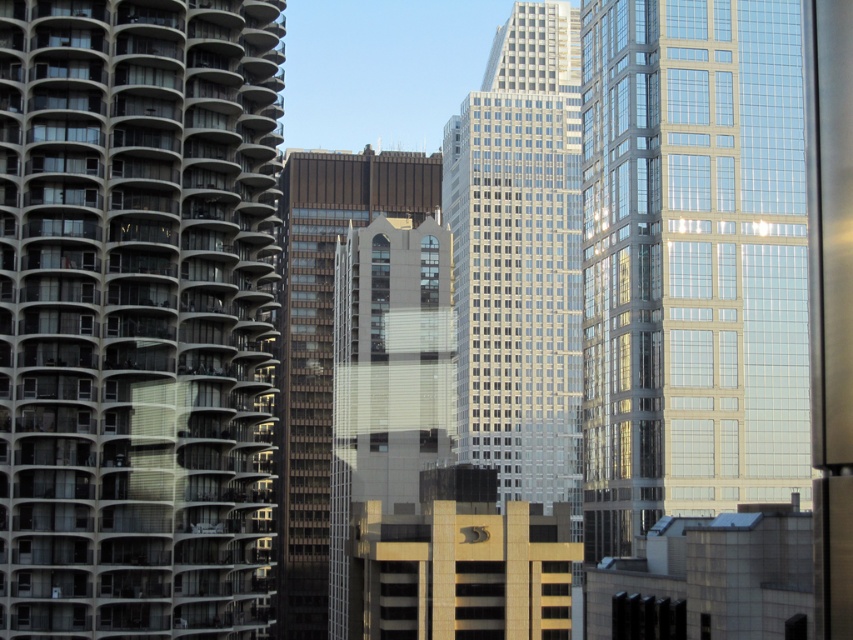
You are a drone operator tasked with flying a drone from the white concrete building at left to the brown glassy building at center. Which building should you start your journey from, and why?

You should start your journey from the white concrete building at left because it is closer to the viewer than the brown glassy building at center, making it the starting point for the drone flight.

You are standing on the observation deck of the clear glass skyscraper at right and want to take a photo of the glassy silver skyscraper at center. Which direction should you face to capture it in your shot?

You should face towards the center of the image because the glassy silver skyscraper at center is located in that direction relative to the clear glass skyscraper at right.